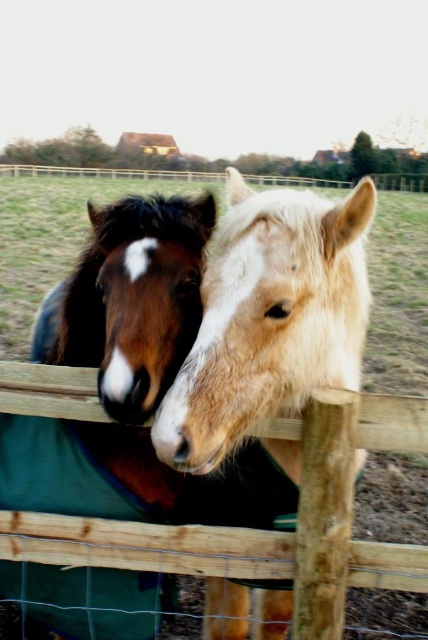
You are a farmer checking the horses in the enclosure. You notice the light brown fur at center and the wooden fence at center. Which object is closer to you?

The light brown fur at center is closer to you because it is positioned over the wooden fence at center, meaning it is in front of the fence.

You are a farmer checking on your animals. You notice the light brown fur at center and the wooden fence at center. Based on their positions, which one is closer to you?

The light brown fur at center is closer to you since it is in front of the wooden fence at center.

You are standing in front of the fence and want to touch the light brown fur at center. Can you reach it if you can extend your arm 3.5 feet?

The light brown fur at center is 3.96 feet away from the camera. Since your arm can only extend 3.5 feet, you cannot reach it.